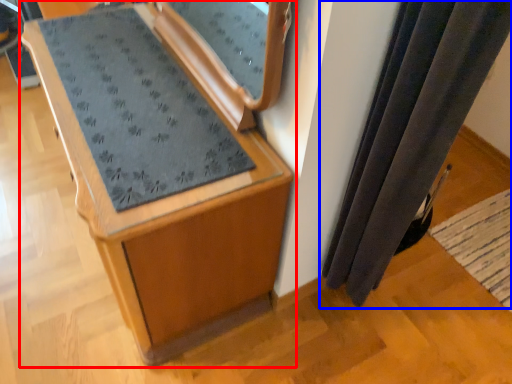
Question: Which object is further to the camera taking this photo, furniture (highlighted by a red box) or curtain (highlighted by a blue box)?

Choices:
 (A) furniture
 (B) curtain

Answer: (A)